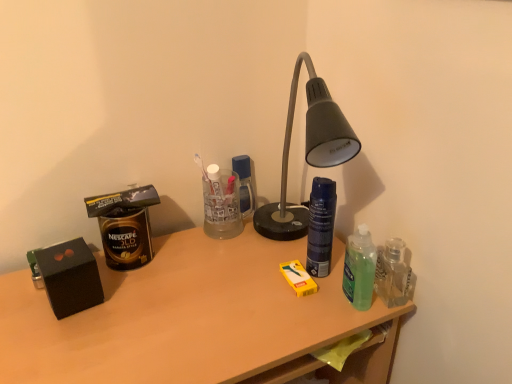
Question: Is matte black box at left inside or outside of shiny dark blue spray can at center-right?

Choices:
 (A) inside
 (B) outside

Answer: (B)

Question: From the image's perspective, is matte black box at left positioned above or below shiny dark blue spray can at center-right?

Choices:
 (A) below
 (B) above

Answer: (A)

Question: Looking at their shapes, would you say matte black box at left is wider or thinner than shiny dark blue spray can at center-right?

Choices:
 (A) wide
 (B) thin

Answer: (A)

Question: Visually, is shiny dark blue spray can at center-right positioned to the left or to the right of matte black box at left?

Choices:
 (A) left
 (B) right

Answer: (B)

Question: Does point (334, 182) appear closer or farther from the camera than point (309, 327)?

Choices:
 (A) closer
 (B) farther

Answer: (B)

Question: Which is correct: shiny dark blue spray can at center-right is inside matte black box at left, or outside of it?

Choices:
 (A) inside
 (B) outside

Answer: (B)

Question: From a real-world perspective, is shiny dark blue spray can at center-right physically located above or below matte black box at left?

Choices:
 (A) below
 (B) above

Answer: (B)